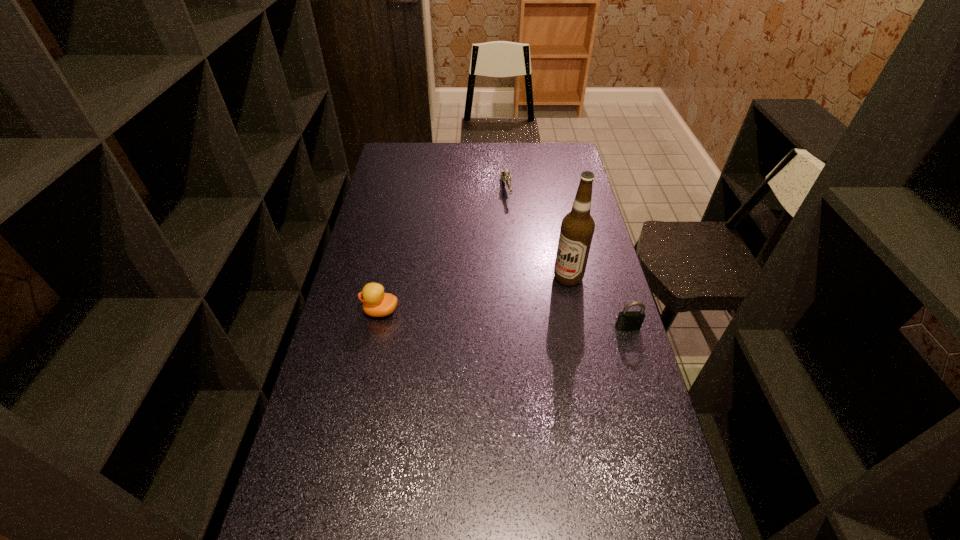
Where is `free spot between the second nearest object and the rightmost object`? The width and height of the screenshot is (960, 540). free spot between the second nearest object and the rightmost object is located at coordinates (504, 319).

What are the coordinates of `empty location between the third farthest object and the rightmost object` in the screenshot? It's located at (504, 319).

Identify the location of object that is the second closest one to the rightmost object. (376, 303).

Identify the location of object identified as the second closest to the gun. (376, 303).